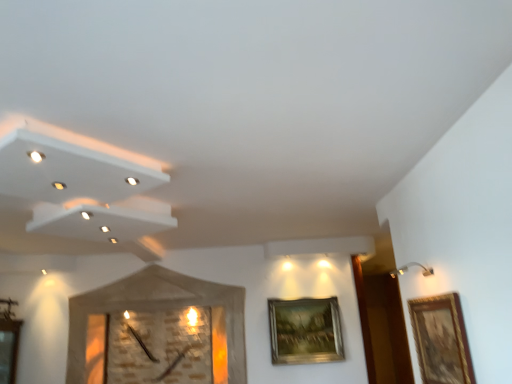
Question: Is gold metallic picture frame at upper right, arranged as the first picture frame when viewed from the back, wider or thinner than gold-framed painting at right, marked as the 1th picture frame in a front-to-back arrangement?

Choices:
 (A) thin
 (B) wide

Answer: (B)

Question: From their relative heights in the image, would you say gold metallic picture frame at upper right, marked as the 1th picture frame in a bottom-to-top arrangement, is taller or shorter than gold-framed painting at right, the second picture frame from the back?

Choices:
 (A) short
 (B) tall

Answer: (B)

Question: Which is farther from the gold-framed painting at right, the second picture frame from the back?

Choices:
 (A) gold metallic picture frame at upper right, positioned as the 2th picture frame in top-to-bottom order
 (B) wooden textured clock at center

Answer: (B)

Question: Which of these objects is positioned closest to the gold-framed painting at right, the 1th picture frame from the right?

Choices:
 (A) gold metallic picture frame at upper right, positioned as the 2th picture frame in top-to-bottom order
 (B) wooden textured clock at center

Answer: (A)